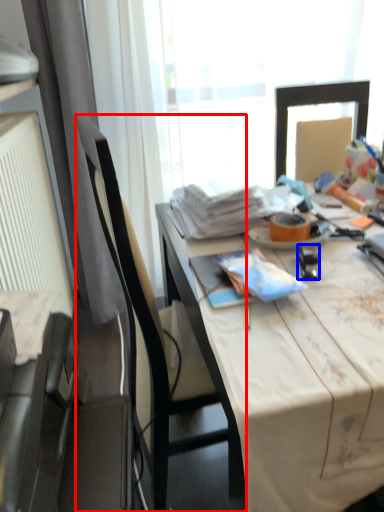
Question: Which of the following is the farthest to the observer, chair (highlighted by a red box) or stationery (highlighted by a blue box)?

Choices:
 (A) chair
 (B) stationery

Answer: (B)